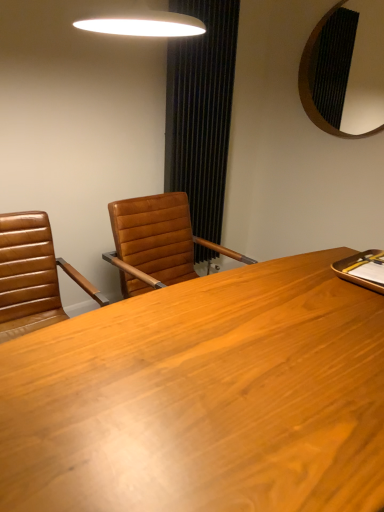
The height and width of the screenshot is (512, 384). What are the coordinates of `free point above wooden desk at center (from a real-world perspective)` in the screenshot? It's located at (223, 369).